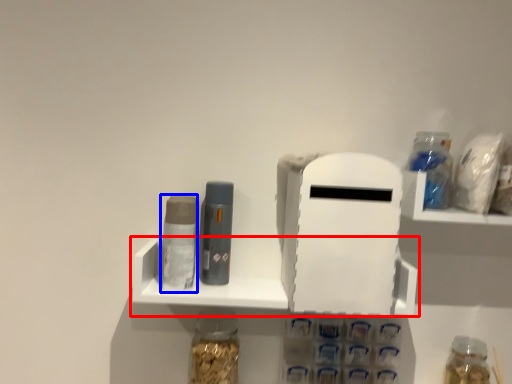
Question: Among these objects, which one is nearest to the camera, shelf (highlighted by a red box) or toiletry (highlighted by a blue box)?

Choices:
 (A) shelf
 (B) toiletry

Answer: (B)